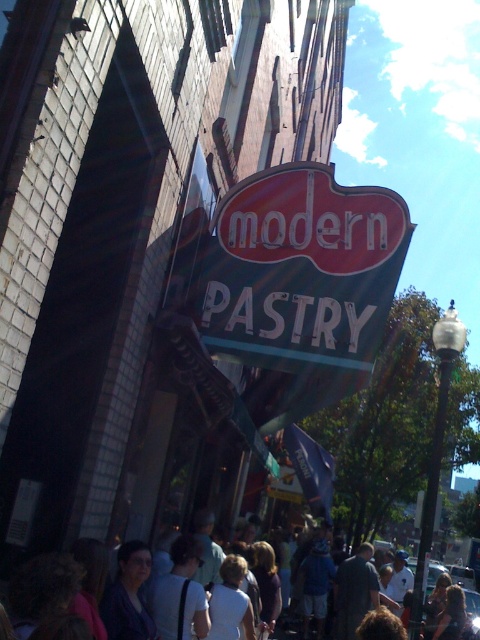
Question: Which point appears closest to the camera in this image?

Choices:
 (A) (242, 273)
 (B) (474, 602)

Answer: (A)

Question: Can you confirm if red plastic sign at center is wider than white cotton shirt at center?

Choices:
 (A) no
 (B) yes

Answer: (A)

Question: Does red plastic sign at center have a smaller size compared to white cotton shirt at center?

Choices:
 (A) yes
 (B) no

Answer: (A)

Question: Is red plastic sign at center above white cotton shirt at center?

Choices:
 (A) yes
 (B) no

Answer: (A)